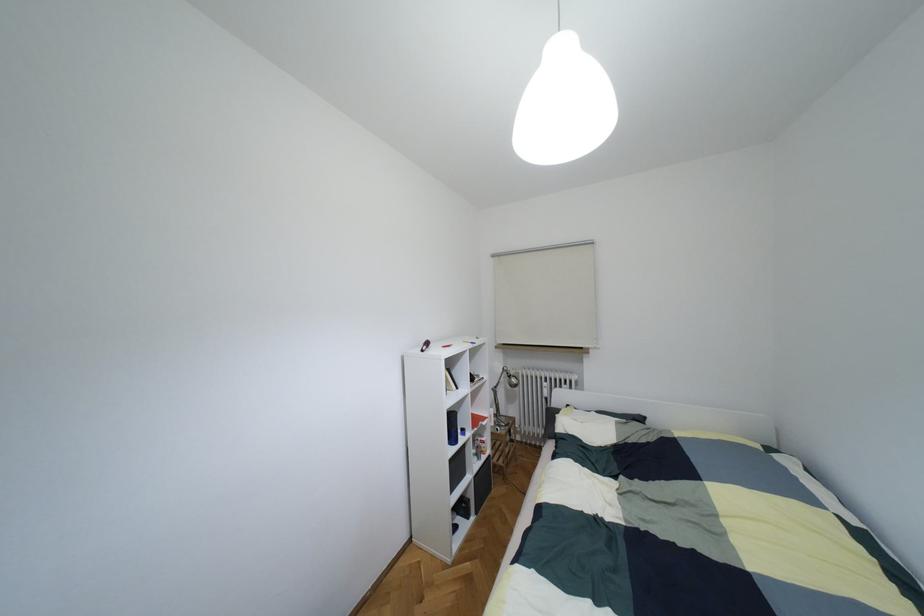
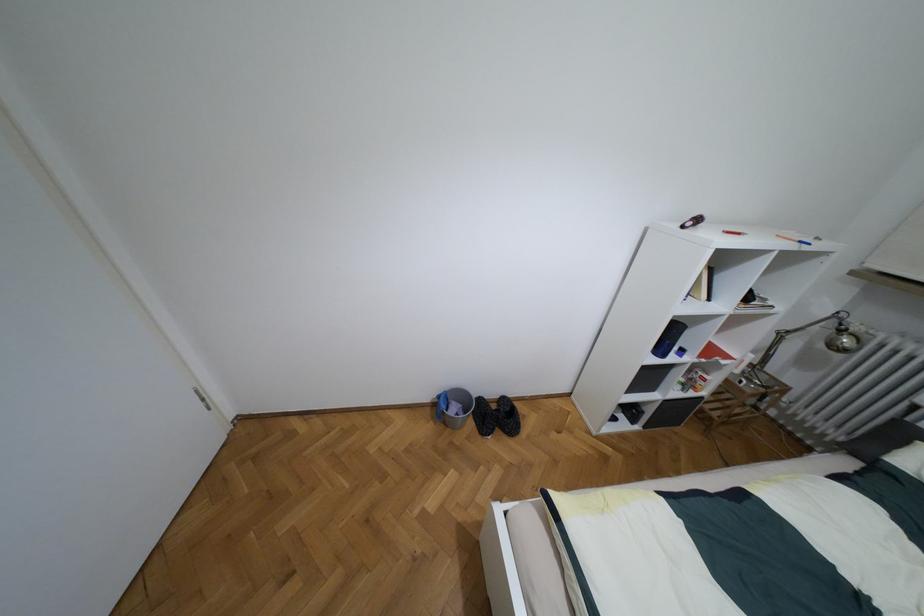
In the second image, find the point that corresponds to the point at 448,345 in the first image.

(737, 233)